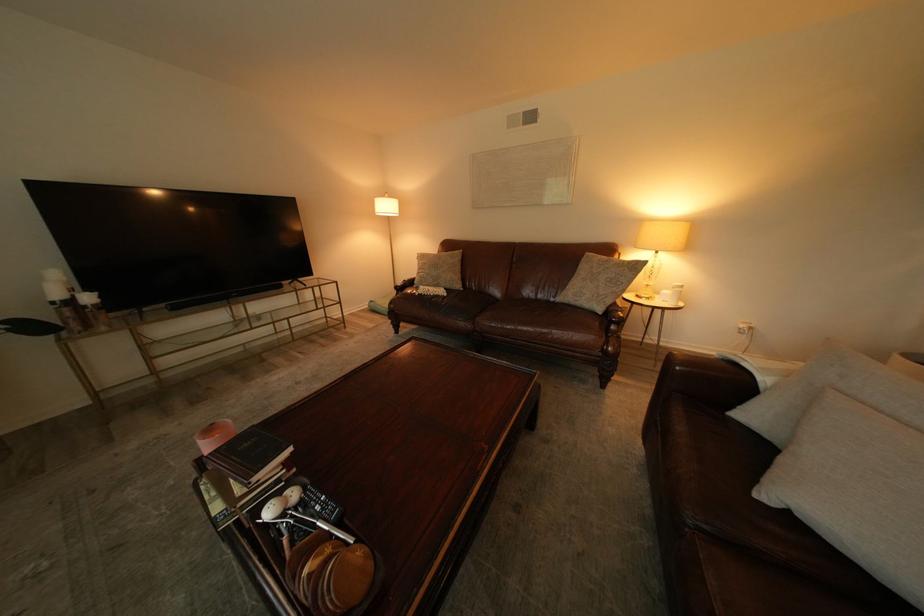
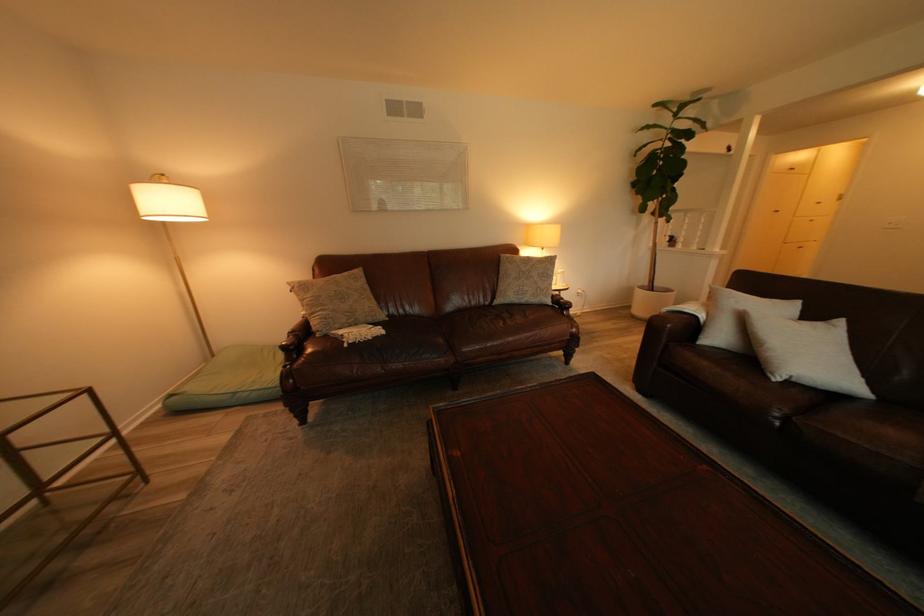
In the second image, find the point that corresponds to the point at 769,496 in the first image.

(787, 381)